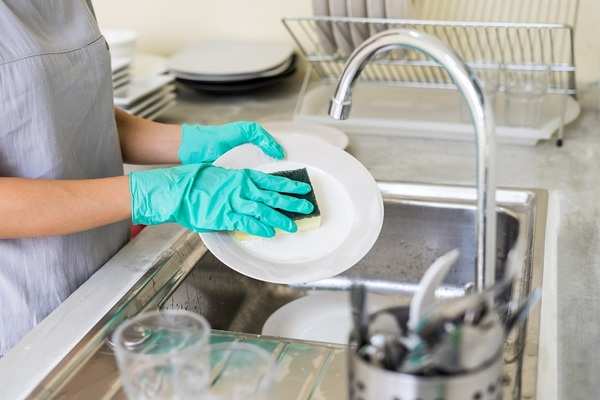
Locate an element on the screen. This screenshot has width=600, height=400. dish drying rack is located at coordinates (540, 51).